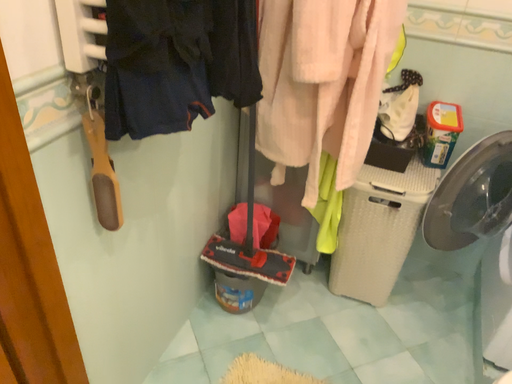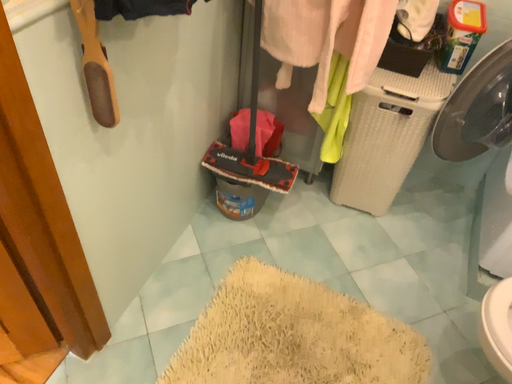
Question: How did the camera likely rotate when shooting the video?

Choices:
 (A) rotated upward
 (B) rotated downward

Answer: (B)